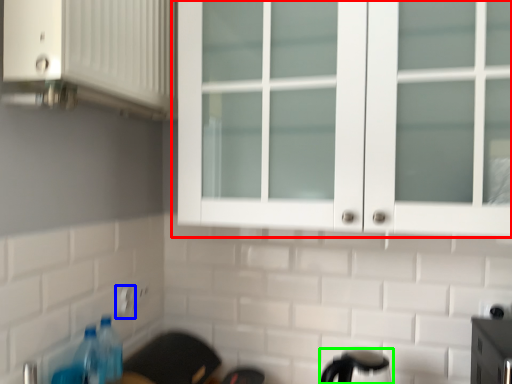
Question: Estimate the real-world distances between objects in this image. Which object is farther from cupboard (highlighted by a red box), electric outlet (highlighted by a blue box) or appliance (highlighted by a green box)?

Choices:
 (A) electric outlet
 (B) appliance

Answer: (A)